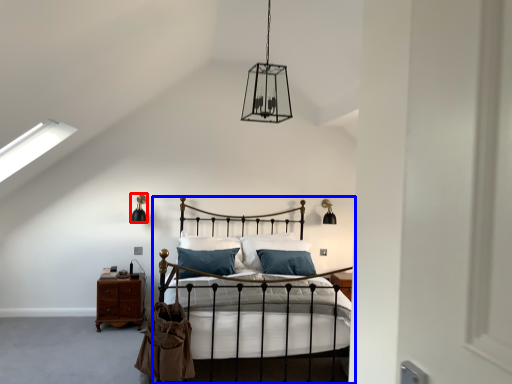
Question: Among these objects, which one is farthest to the camera, light fixture (highlighted by a red box) or bed (highlighted by a blue box)?

Choices:
 (A) light fixture
 (B) bed

Answer: (A)